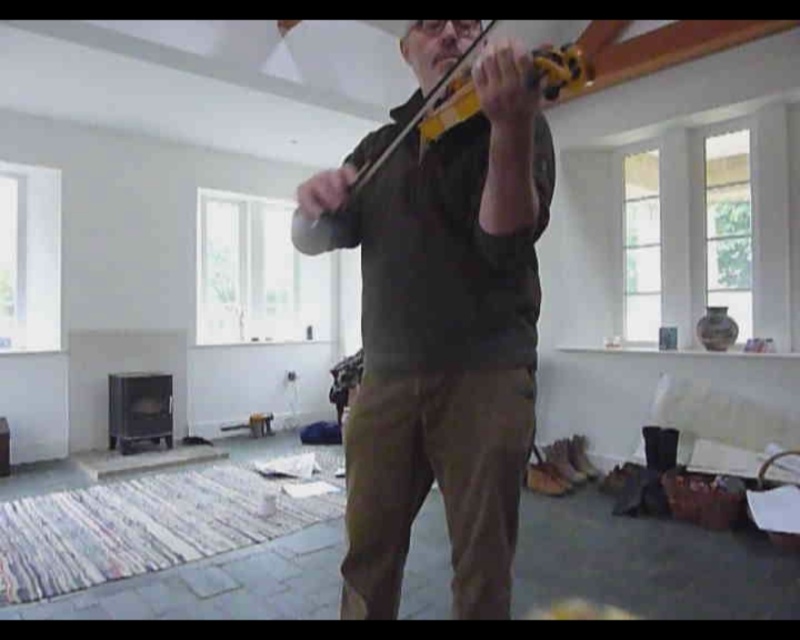
Is matte black violin at center behind yellow matte violin at center?

No, matte black violin at center is in front of yellow matte violin at center.

Locate an element on the screen. This screenshot has height=640, width=800. matte black violin at center is located at coordinates (440, 324).

Identify the location of matte black violin at center. This screenshot has height=640, width=800. (440, 324).